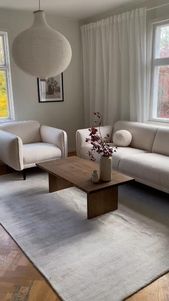
I want to click on round pillow, so click(125, 137).